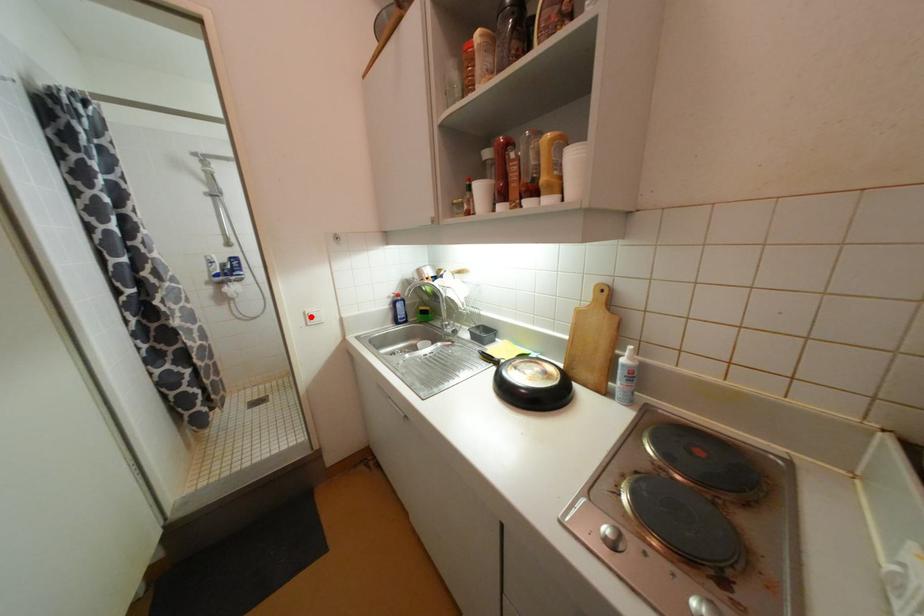
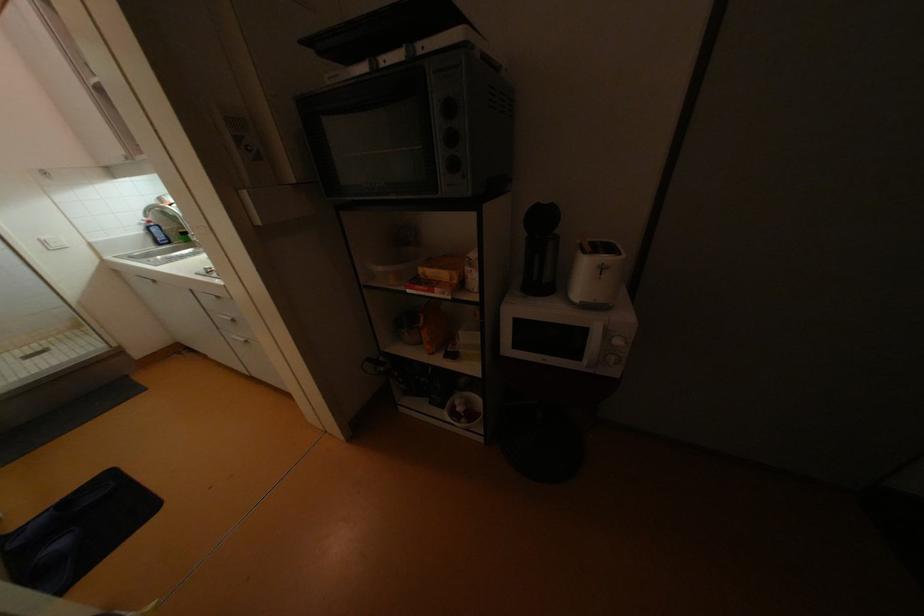
Question: A red point is marked in image1. In image2, is the corresponding 3D point closer to the camera or farther? Reply with the corresponding letter.

Choices:
 (A) The corresponding 3D point is closer.
 (B) The corresponding 3D point is farther.

Answer: (B)